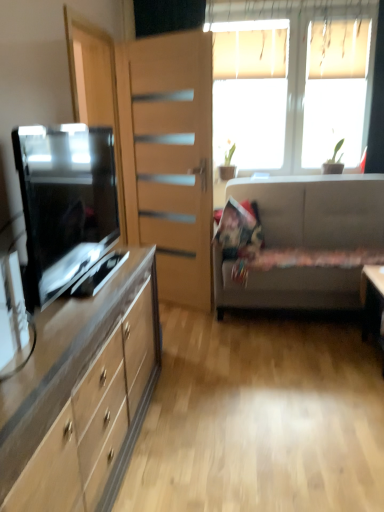
The height and width of the screenshot is (512, 384). What are the coordinates of `vacant space situated above white plastic window at upper right (from a real-world perspective)` in the screenshot? It's located at (290, 7).